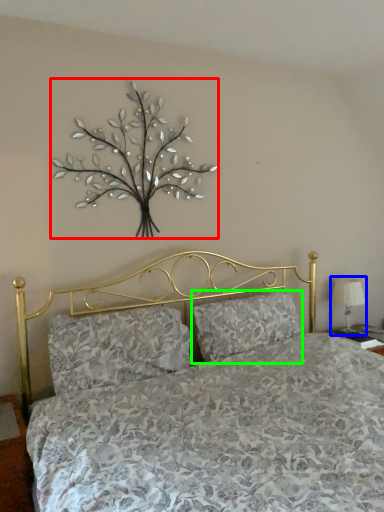
Question: Estimate the real-world distances between objects in this image. Which object is farther from floral arrangement (highlighted by a red box), table lamp (highlighted by a blue box) or pillow (highlighted by a green box)?

Choices:
 (A) table lamp
 (B) pillow

Answer: (A)